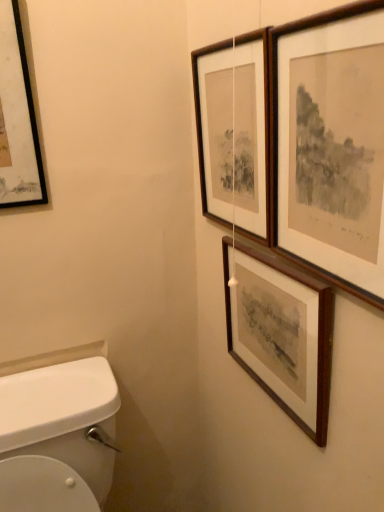
Describe the element at coordinates (283, 335) in the screenshot. I see `wooden picture frame at upper right, the third picture frame from the left` at that location.

What is the approximate width of wooden framed print at upper right, marked as the 1th picture frame in a right-to-left arrangement?

It is 1.09 inches.

What do you see at coordinates (235, 131) in the screenshot?
I see `wooden picture frame at upper right, which ranks as the second picture frame in left-to-right order` at bounding box center [235, 131].

The height and width of the screenshot is (512, 384). Identify the location of black matte picture frame at upper left, positioned as the first picture frame in left-to-right order. (17, 119).

Locate an element on the screen. wooden picture frame at upper right, the second picture frame from the right is located at coordinates (283, 335).

Is wooden picture frame at upper right, which ranks as the second picture frame in left-to-right order, in front of or behind black matte picture frame at upper left, which is counted as the fourth picture frame, starting from the right, in the image?

wooden picture frame at upper right, which ranks as the second picture frame in left-to-right order, is in front of black matte picture frame at upper left, which is counted as the fourth picture frame, starting from the right.

Is wooden picture frame at upper right, which is the 3th picture frame from right to left, bigger than black matte picture frame at upper left, which is counted as the fourth picture frame, starting from the right?

Correct, wooden picture frame at upper right, which is the 3th picture frame from right to left, is larger in size than black matte picture frame at upper left, which is counted as the fourth picture frame, starting from the right.

Looking at this image, how far apart are wooden picture frame at upper right, which is the 3th picture frame from right to left, and black matte picture frame at upper left, which is counted as the fourth picture frame, starting from the right?

The distance of wooden picture frame at upper right, which is the 3th picture frame from right to left, from black matte picture frame at upper left, which is counted as the fourth picture frame, starting from the right, is 16.72 inches.

Is black matte picture frame at upper left, which is counted as the fourth picture frame, starting from the right, inside or outside of wooden framed print at upper right, marked as the 1th picture frame in a right-to-left arrangement?

black matte picture frame at upper left, which is counted as the fourth picture frame, starting from the right, is not enclosed by wooden framed print at upper right, marked as the 1th picture frame in a right-to-left arrangement.

Looking at their sizes, would you say black matte picture frame at upper left, which is counted as the fourth picture frame, starting from the right, is wider or thinner than wooden framed print at upper right, the 4th picture frame in the left-to-right sequence?

Considering their sizes, black matte picture frame at upper left, which is counted as the fourth picture frame, starting from the right, looks broader than wooden framed print at upper right, the 4th picture frame in the left-to-right sequence.

Who is taller, black matte picture frame at upper left, which is counted as the fourth picture frame, starting from the right, or wooden framed print at upper right, the 4th picture frame in the left-to-right sequence?

With more height is black matte picture frame at upper left, which is counted as the fourth picture frame, starting from the right.

Considering the sizes of black matte picture frame at upper left, positioned as the first picture frame in left-to-right order, and wooden framed print at upper right, the 4th picture frame in the left-to-right sequence, in the image, is black matte picture frame at upper left, positioned as the first picture frame in left-to-right order, bigger or smaller than wooden framed print at upper right, the 4th picture frame in the left-to-right sequence,?

black matte picture frame at upper left, positioned as the first picture frame in left-to-right order, is bigger than wooden framed print at upper right, the 4th picture frame in the left-to-right sequence.

Is wooden framed print at upper right, marked as the 1th picture frame in a right-to-left arrangement, to the left of wooden picture frame at upper right, the third picture frame from the left, from the viewer's perspective?

No, wooden framed print at upper right, marked as the 1th picture frame in a right-to-left arrangement, is not to the left of wooden picture frame at upper right, the third picture frame from the left.

Can you confirm if wooden framed print at upper right, the 4th picture frame in the left-to-right sequence, is thinner than wooden picture frame at upper right, the second picture frame from the right?

Indeed, wooden framed print at upper right, the 4th picture frame in the left-to-right sequence, has a lesser width compared to wooden picture frame at upper right, the second picture frame from the right.

Is wooden framed print at upper right, marked as the 1th picture frame in a right-to-left arrangement, turned away from wooden picture frame at upper right, the second picture frame from the right?

wooden framed print at upper right, marked as the 1th picture frame in a right-to-left arrangement, is not turned away from wooden picture frame at upper right, the second picture frame from the right.

Does wooden framed print at upper right, marked as the 1th picture frame in a right-to-left arrangement, have a greater height compared to wooden picture frame at upper right, the second picture frame from the right?

Yes, wooden framed print at upper right, marked as the 1th picture frame in a right-to-left arrangement, is taller than wooden picture frame at upper right, the second picture frame from the right.

Considering the sizes of objects wooden picture frame at upper right, the third picture frame from the left, and wooden framed print at upper right, the 4th picture frame in the left-to-right sequence, in the image provided, who is taller, wooden picture frame at upper right, the third picture frame from the left, or wooden framed print at upper right, the 4th picture frame in the left-to-right sequence,?

wooden framed print at upper right, the 4th picture frame in the left-to-right sequence.

Is there a large distance between wooden picture frame at upper right, the second picture frame from the right, and wooden framed print at upper right, the 4th picture frame in the left-to-right sequence?

Actually, wooden picture frame at upper right, the second picture frame from the right, and wooden framed print at upper right, the 4th picture frame in the left-to-right sequence, are a little close together.

Do you think wooden picture frame at upper right, the third picture frame from the left, is within wooden framed print at upper right, the 4th picture frame in the left-to-right sequence, or outside of it?

wooden picture frame at upper right, the third picture frame from the left, is not inside wooden framed print at upper right, the 4th picture frame in the left-to-right sequence, it's outside.

From the image's perspective, between wooden framed print at upper right, marked as the 1th picture frame in a right-to-left arrangement, and wooden picture frame at upper right, which ranks as the second picture frame in left-to-right order, who is located below?

wooden framed print at upper right, marked as the 1th picture frame in a right-to-left arrangement, is shown below in the image.

Is wooden framed print at upper right, the 4th picture frame in the left-to-right sequence, shorter than wooden picture frame at upper right, which ranks as the second picture frame in left-to-right order?

Yes, wooden framed print at upper right, the 4th picture frame in the left-to-right sequence, is shorter than wooden picture frame at upper right, which ranks as the second picture frame in left-to-right order.

Are wooden framed print at upper right, the 4th picture frame in the left-to-right sequence, and wooden picture frame at upper right, which is the 3th picture frame from right to left, located far from each other?

That's not correct — wooden framed print at upper right, the 4th picture frame in the left-to-right sequence, is a little close to wooden picture frame at upper right, which is the 3th picture frame from right to left.

Find the location of `the 1st picture frame located beneath the wooden picture frame at upper right, which is the 3th picture frame from right to left (from a real-world perspective)`. the 1st picture frame located beneath the wooden picture frame at upper right, which is the 3th picture frame from right to left (from a real-world perspective) is located at coordinates (330, 145).

Is wooden framed print at upper right, the 4th picture frame in the left-to-right sequence, at the back of wooden picture frame at upper right, which ranks as the second picture frame in left-to-right order?

wooden picture frame at upper right, which ranks as the second picture frame in left-to-right order, does not have its back to wooden framed print at upper right, the 4th picture frame in the left-to-right sequence.

Is wooden picture frame at upper right, which ranks as the second picture frame in left-to-right order, positioned far away from wooden framed print at upper right, marked as the 1th picture frame in a right-to-left arrangement?

No, wooden picture frame at upper right, which ranks as the second picture frame in left-to-right order, is not far away from wooden framed print at upper right, marked as the 1th picture frame in a right-to-left arrangement.

Is wooden picture frame at upper right, which is the 3th picture frame from right to left, to the right of wooden framed print at upper right, the 4th picture frame in the left-to-right sequence, from the viewer's perspective?

In fact, wooden picture frame at upper right, which is the 3th picture frame from right to left, is to the left of wooden framed print at upper right, the 4th picture frame in the left-to-right sequence.

Is black matte picture frame at upper left, positioned as the first picture frame in left-to-right order, at the left side of wooden picture frame at upper right, the second picture frame from the right?

Yes, black matte picture frame at upper left, positioned as the first picture frame in left-to-right order, is to the left of wooden picture frame at upper right, the second picture frame from the right.

Between black matte picture frame at upper left, which is counted as the fourth picture frame, starting from the right, and wooden picture frame at upper right, the third picture frame from the left, which one has larger width?

With larger width is wooden picture frame at upper right, the third picture frame from the left.

Is point (1, 169) behind point (255, 332)?

That is True.

From the image's perspective, is black matte picture frame at upper left, positioned as the first picture frame in left-to-right order, located above wooden picture frame at upper right, the third picture frame from the left?

Correct, black matte picture frame at upper left, positioned as the first picture frame in left-to-right order, appears higher than wooden picture frame at upper right, the third picture frame from the left, in the image.

Image resolution: width=384 pixels, height=512 pixels. Identify the location of picture frame that is above the wooden picture frame at upper right, which is the 3th picture frame from right to left (from the image's perspective). (17, 119).

Where is `the 2nd picture frame below the black matte picture frame at upper left, positioned as the first picture frame in left-to-right order (from a real-world perspective)`? The image size is (384, 512). the 2nd picture frame below the black matte picture frame at upper left, positioned as the first picture frame in left-to-right order (from a real-world perspective) is located at coordinates (330, 145).

From the image, which object appears to be farther from wooden picture frame at upper right, the third picture frame from the left, wooden picture frame at upper right, which ranks as the second picture frame in left-to-right order, or wooden framed print at upper right, marked as the 1th picture frame in a right-to-left arrangement?

wooden picture frame at upper right, which ranks as the second picture frame in left-to-right order, is positioned further to the anchor wooden picture frame at upper right, the third picture frame from the left.

When comparing their distances from black matte picture frame at upper left, positioned as the first picture frame in left-to-right order, does wooden framed print at upper right, the 4th picture frame in the left-to-right sequence, or wooden picture frame at upper right, which is the 3th picture frame from right to left, seem closer?

wooden picture frame at upper right, which is the 3th picture frame from right to left, is positioned closer to the anchor black matte picture frame at upper left, positioned as the first picture frame in left-to-right order.

Estimate the real-world distances between objects in this image. Which object is further from wooden picture frame at upper right, the second picture frame from the right, wooden picture frame at upper right, which ranks as the second picture frame in left-to-right order, or black matte picture frame at upper left, positioned as the first picture frame in left-to-right order?

Based on the image, black matte picture frame at upper left, positioned as the first picture frame in left-to-right order, appears to be further to wooden picture frame at upper right, the second picture frame from the right.

Looking at the image, which one is located closer to wooden picture frame at upper right, the second picture frame from the right, black matte picture frame at upper left, positioned as the first picture frame in left-to-right order, or wooden framed print at upper right, the 4th picture frame in the left-to-right sequence?

wooden framed print at upper right, the 4th picture frame in the left-to-right sequence.

Based on their spatial positions, is wooden framed print at upper right, marked as the 1th picture frame in a right-to-left arrangement, or black matte picture frame at upper left, which is counted as the fourth picture frame, starting from the right, closer to wooden picture frame at upper right, which ranks as the second picture frame in left-to-right order?

The object closer to wooden picture frame at upper right, which ranks as the second picture frame in left-to-right order, is wooden framed print at upper right, marked as the 1th picture frame in a right-to-left arrangement.

Looking at the image, which one is located further to black matte picture frame at upper left, which is counted as the fourth picture frame, starting from the right, wooden picture frame at upper right, the third picture frame from the left, or wooden picture frame at upper right, which is the 3th picture frame from right to left?

Based on the image, wooden picture frame at upper right, the third picture frame from the left, appears to be further to black matte picture frame at upper left, which is counted as the fourth picture frame, starting from the right.

Based on their spatial positions, is wooden picture frame at upper right, the second picture frame from the right, or wooden framed print at upper right, the 4th picture frame in the left-to-right sequence, further from wooden picture frame at upper right, which ranks as the second picture frame in left-to-right order?

Based on the image, wooden picture frame at upper right, the second picture frame from the right, appears to be further to wooden picture frame at upper right, which ranks as the second picture frame in left-to-right order.

Considering their positions, is wooden picture frame at upper right, which ranks as the second picture frame in left-to-right order, positioned further to black matte picture frame at upper left, positioned as the first picture frame in left-to-right order, than wooden framed print at upper right, the 4th picture frame in the left-to-right sequence?

The object further to black matte picture frame at upper left, positioned as the first picture frame in left-to-right order, is wooden framed print at upper right, the 4th picture frame in the left-to-right sequence.

The height and width of the screenshot is (512, 384). In order to click on picture frame between wooden picture frame at upper right, which is the 3th picture frame from right to left, and wooden picture frame at upper right, the third picture frame from the left, from top to bottom in this screenshot , I will do `click(330, 145)`.

At what (x,y) coordinates should I click in order to perform the action: click on picture frame situated between black matte picture frame at upper left, positioned as the first picture frame in left-to-right order, and wooden picture frame at upper right, the second picture frame from the right, from left to right. Please return your answer as a coordinate pair (x, y). Image resolution: width=384 pixels, height=512 pixels. Looking at the image, I should click on (235, 131).